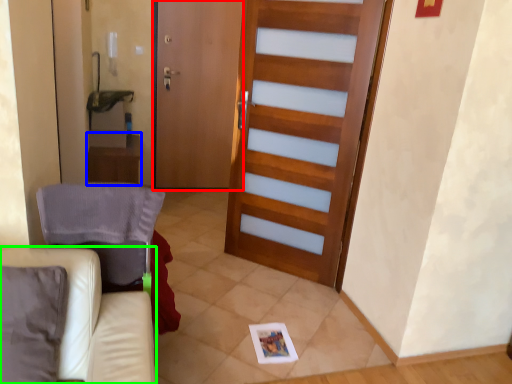
Question: Which object is the closest to the screen door (highlighted by a red box)? Choose among these: table (highlighted by a blue box) or furniture (highlighted by a green box).

Choices:
 (A) table
 (B) furniture

Answer: (A)